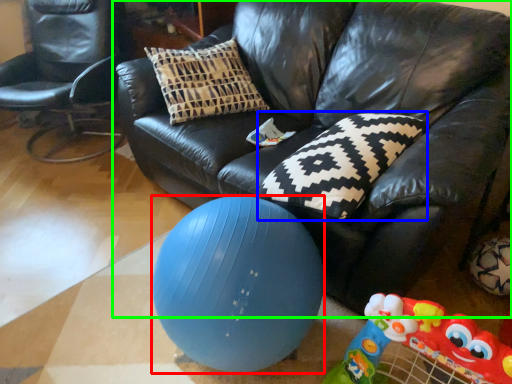
Question: Which is farther away from ball (highlighted by a red box)? pillow (highlighted by a blue box) or studio couch (highlighted by a green box)?

Choices:
 (A) pillow
 (B) studio couch

Answer: (B)